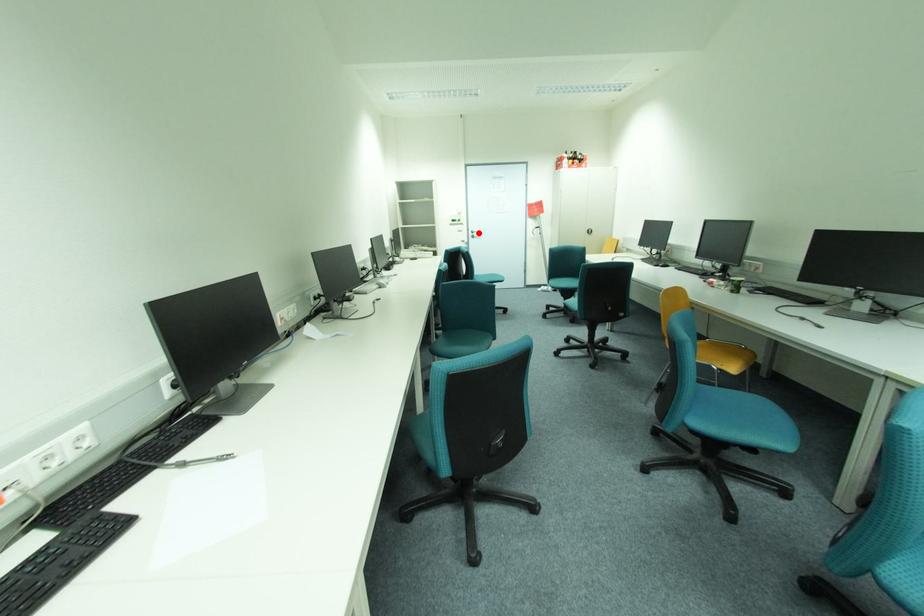
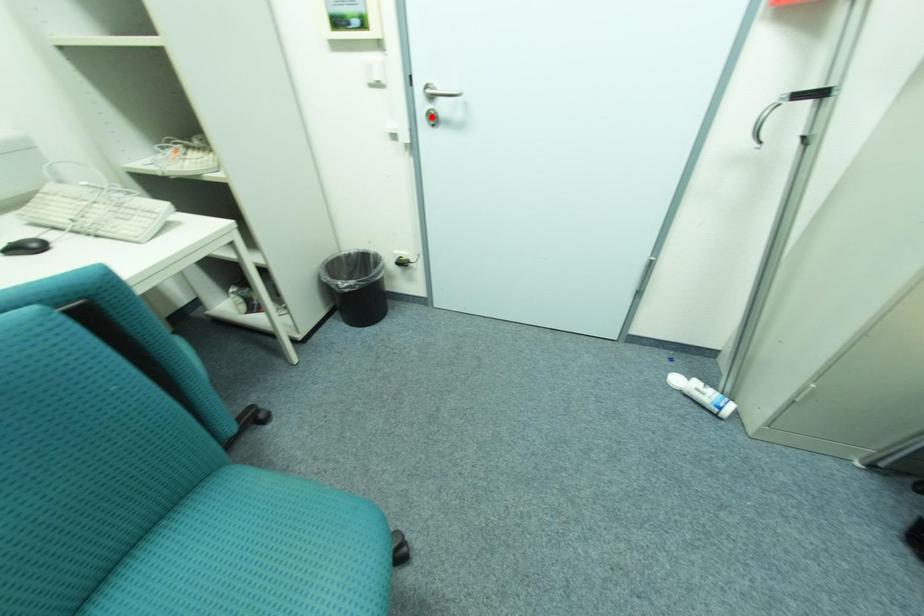
I am providing you with two images of the same scene from different viewpoints. A red point is marked on the first image and another point is marked on the second image. Do the highlighted points in image1 and image2 indicate the same real-world spot?

No